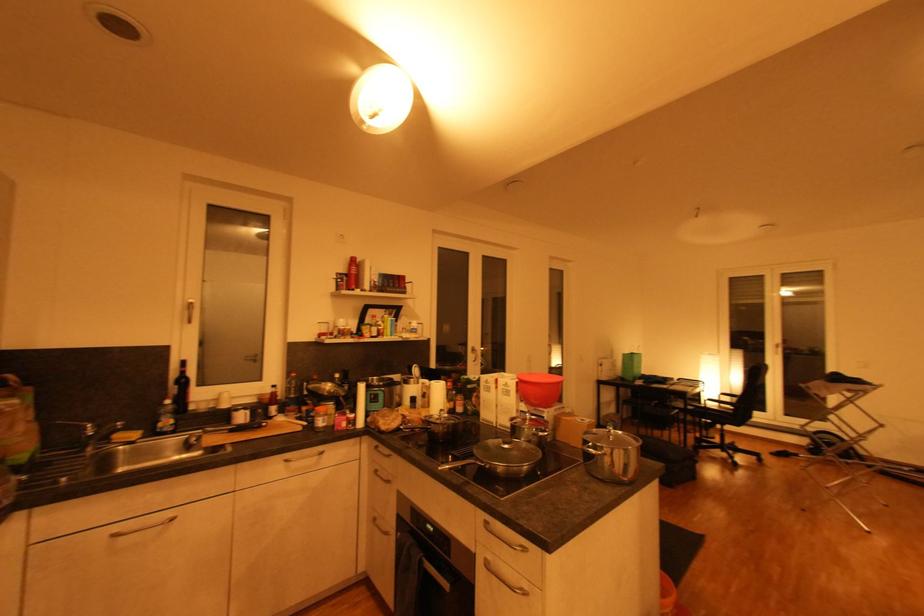
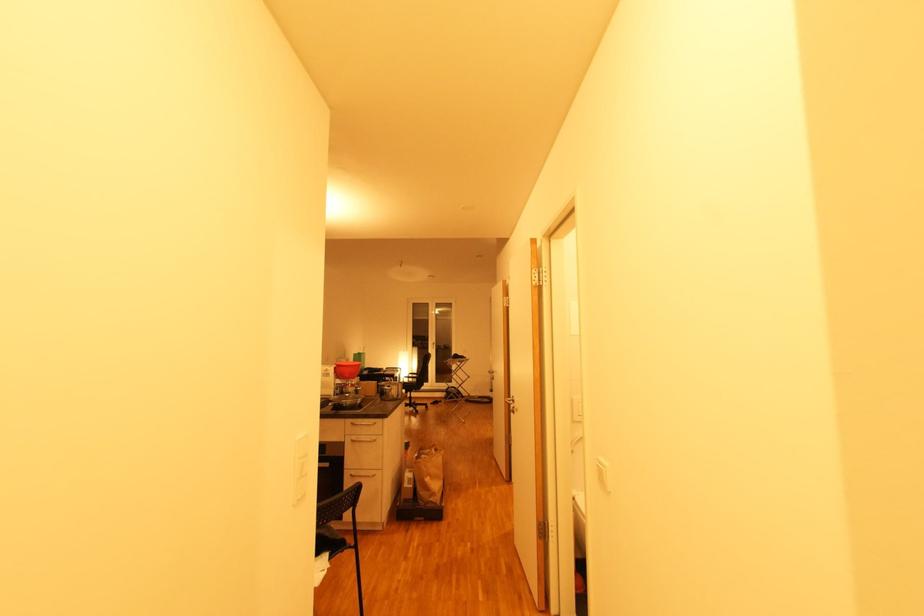
Find the pixel in the second image that matches (x=553, y=557) in the first image.

(391, 421)